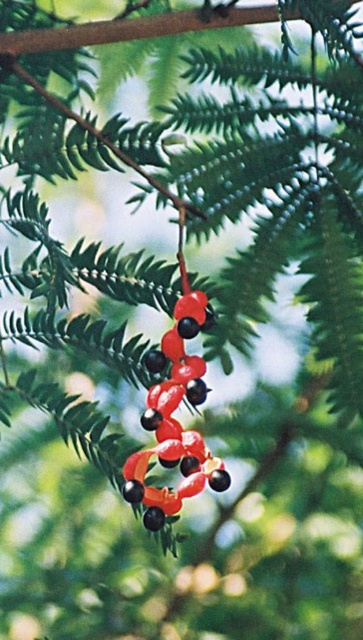
You are a botanist examining the image of the plant. The coordinates given are in a normalized system where the bottom left corner is the origin. Where would you find the glossy red berries at center in terms of their 2D position?

The glossy red berries at center are located at the 2D coordinates point [174,420].

You are a botanist examining a plant with berries. You notice a point at coordinates [174,420]. What is located at this point?

The point at [174,420] indicates glossy red berries at center.

You are a gardener who wants to prune the plant. You need to know which part is taller between the glossy red berries at center and the green matte branch at center. Which one is taller?

The glossy red berries at center is taller than the green matte branch at center according to the description.